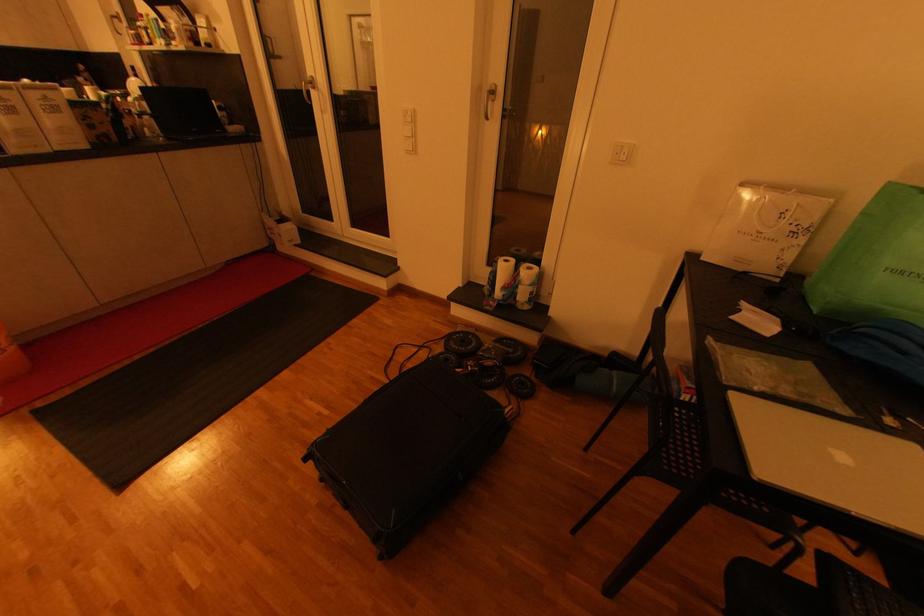
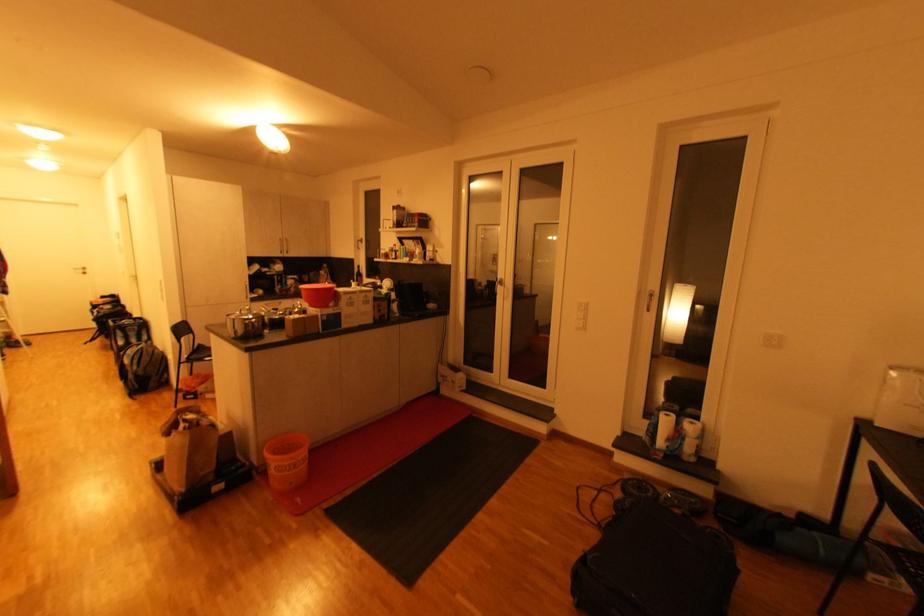
The point at (x=533, y=269) is marked in the first image. Where is the corresponding point in the second image?

(698, 424)